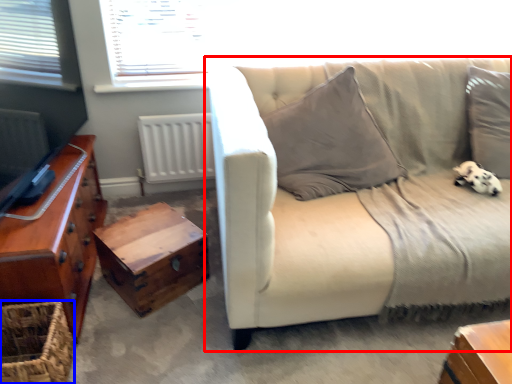
Question: Which object is closer to the camera taking this photo, studio couch (highlighted by a red box) or basket (highlighted by a blue box)?

Choices:
 (A) studio couch
 (B) basket

Answer: (A)